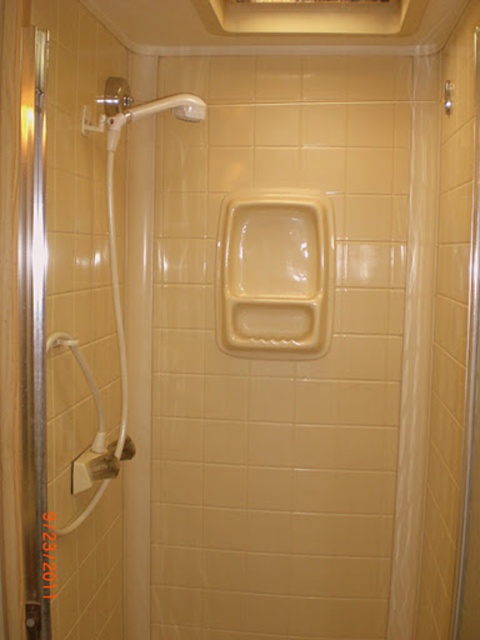
Question: Is beige matte urinal at center to the left of clear plastic shower curtain at right from the viewer's perspective?

Choices:
 (A) yes
 (B) no

Answer: (A)

Question: Can you confirm if beige matte urinal at center is smaller than clear plastic shower curtain at right?

Choices:
 (A) yes
 (B) no

Answer: (A)

Question: Which object is farther from the camera taking this photo?

Choices:
 (A) beige matte urinal at center
 (B) clear plastic shower curtain at right

Answer: (A)

Question: Among these points, which one is nearest to the camera?

Choices:
 (A) (242, 310)
 (B) (406, 616)

Answer: (A)

Question: Is beige matte urinal at center positioned behind clear plastic shower curtain at right?

Choices:
 (A) yes
 (B) no

Answer: (A)